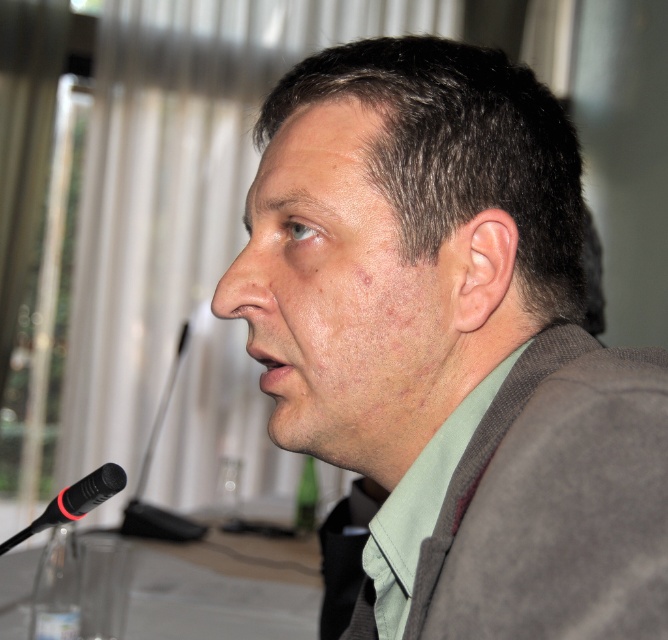
You are attending a conference and need to place a small note on the table between the two points labeled point (478, 396) and point (98, 496). Can you tell me which point is closer to you so you can place the note appropriately?

Point (478, 396) is closer to the viewer than point (98, 496), so you should place the note closer to point (478, 396).

You are attending a virtual conference and need to present your slides. The camera is focused on the matte gray suit at center. Can you see the clear glass table at lower left in your webcam feed?

The matte gray suit at center is closer to the viewer than the clear glass table at lower left, so the clear glass table at lower left may be partially or fully out of focus in the webcam feed depending on the camera settings.

You are a photographer at a formal event. You need to capture a closeup shot of the black rubberized microphone at lower left and the green glass bottle at lower center. Which object is closer to the camera?

The black rubberized microphone at lower left is positioned over the green glass bottle at lower center, so it is closer to the camera.